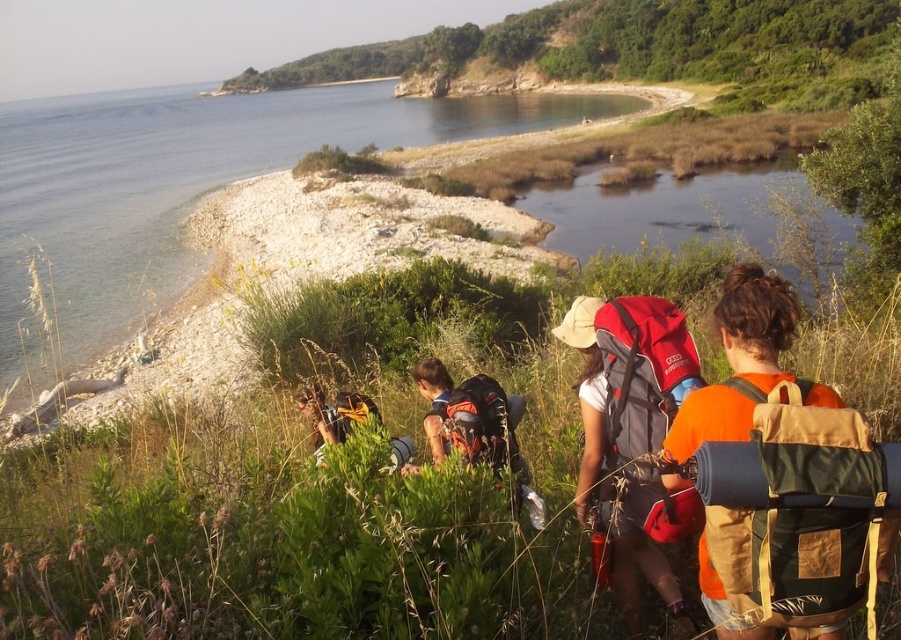
Does green leafy grass at center have a larger size compared to green leafy hillside at upper center?

No, green leafy grass at center is not bigger than green leafy hillside at upper center.

Is point (287, 474) farther from camera compared to point (854, 96)?

No, (287, 474) is in front of (854, 96).

You are a GUI agent. You are given a task and a screenshot of the screen. Output one action in this format:
    pyautogui.click(x=<x>, y=<y>)
    Task: Click on the green leafy grass at center
    This screenshot has width=901, height=640.
    Given the screenshot: What is the action you would take?
    pyautogui.click(x=287, y=532)

Can you confirm if clear blue water at upper left is taller than matte gray backpack at center?

Indeed, clear blue water at upper left has a greater height compared to matte gray backpack at center.

Find the location of a particular element. The width and height of the screenshot is (901, 640). clear blue water at upper left is located at coordinates (181, 189).

Can you confirm if matte gray backpack at center is positioned to the right of brushed metal backpack at lower center?

Correct, you'll find matte gray backpack at center to the right of brushed metal backpack at lower center.

Who is positioned more to the left, matte gray backpack at center or brushed metal backpack at lower center?

brushed metal backpack at lower center is more to the left.

Is point (681, 520) in front of point (319, 429)?

That is True.

The height and width of the screenshot is (640, 901). I want to click on matte gray backpack at center, so click(x=645, y=408).